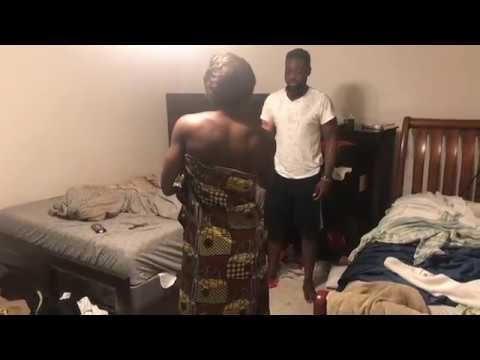
I want to click on blanket, so coord(417,206).